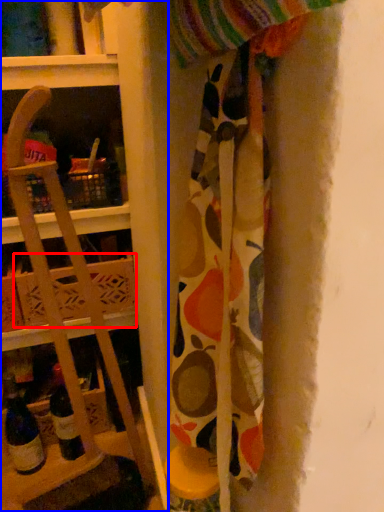
Question: Which of the following is the closest to the observer, cardboard box (highlighted by a red box) or shelf (highlighted by a blue box)?

Choices:
 (A) cardboard box
 (B) shelf

Answer: (B)